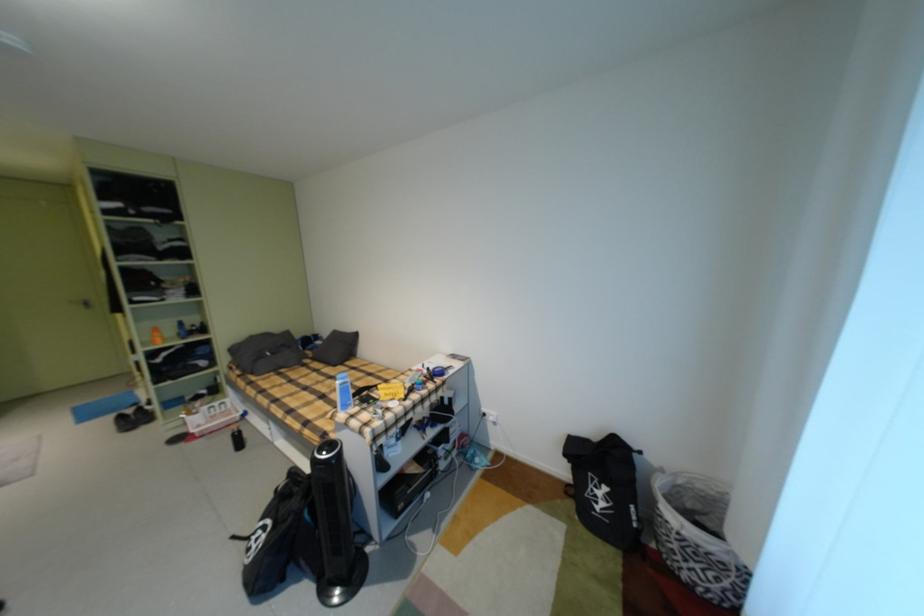
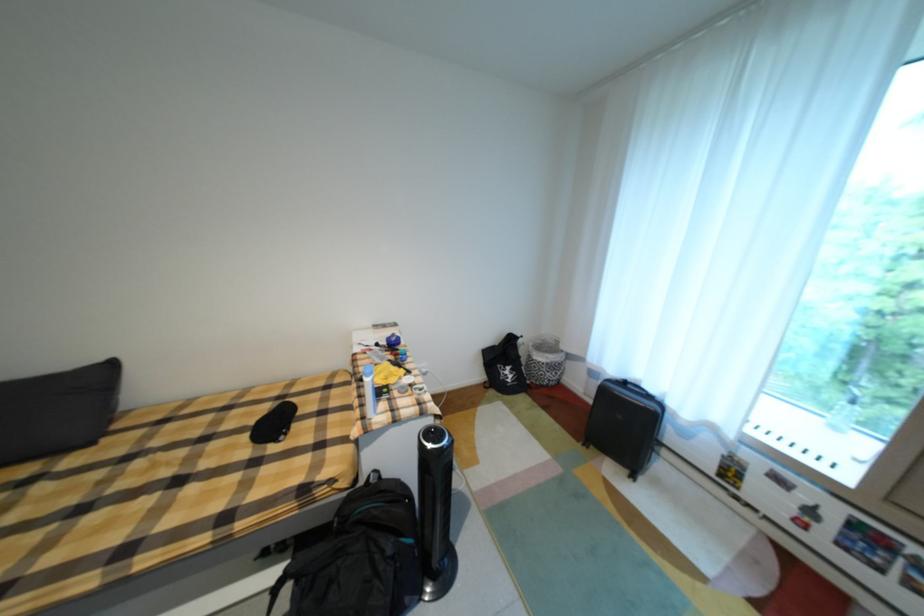
Find the pixel in the second image that matches (x=650, y=454) in the first image.

(531, 338)